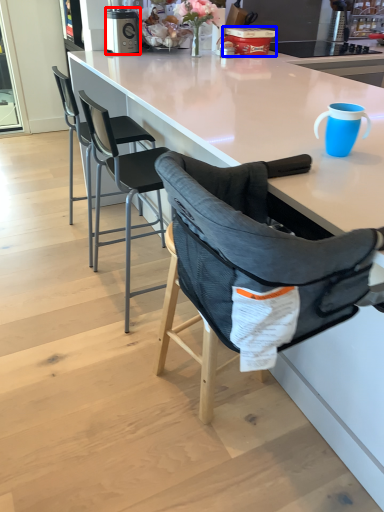
Question: Which point is closer to the camera, kitchen appliance (highlighted by a red box) or appliance (highlighted by a blue box)?

Choices:
 (A) kitchen appliance
 (B) appliance

Answer: (A)